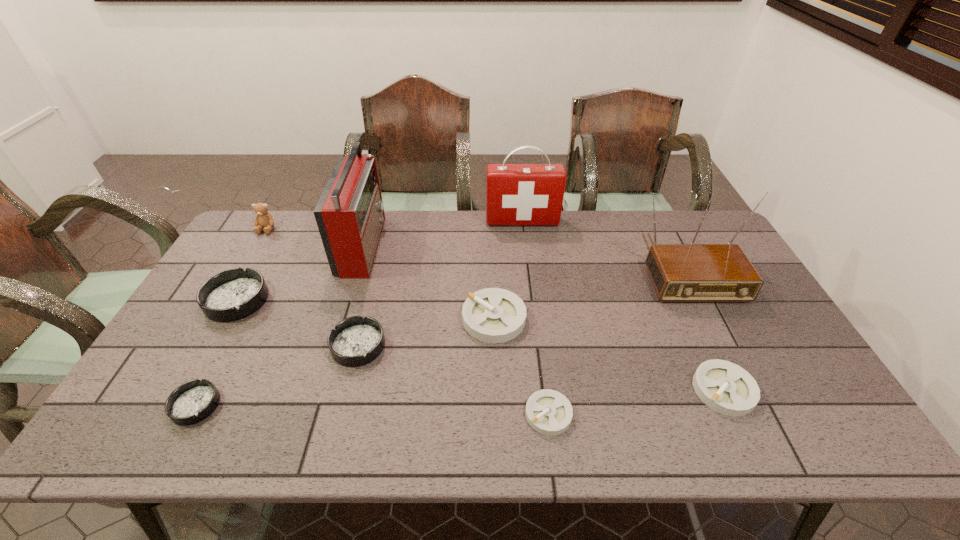
Where is `the left radio_receiver`? Image resolution: width=960 pixels, height=540 pixels. the left radio_receiver is located at coordinates (350, 216).

The height and width of the screenshot is (540, 960). In order to click on red first-aid kit in this screenshot , I will do 516,194.

Image resolution: width=960 pixels, height=540 pixels. Identify the location of the right radio_receiver. (692, 272).

The height and width of the screenshot is (540, 960). Find the location of `the seventh shortest object`. the seventh shortest object is located at coordinates (263, 219).

At what (x,y) coordinates should I click in order to perform the action: click on teddy bear. Please return your answer as a coordinate pair (x, y). This screenshot has height=540, width=960. Looking at the image, I should click on (263, 219).

Identify the location of the biggest dark ashtray. (233, 294).

At what (x,y) coordinates should I click in order to perform the action: click on the farthest gray ashtray. Please return your answer as a coordinate pair (x, y). Image resolution: width=960 pixels, height=540 pixels. Looking at the image, I should click on (493, 315).

The image size is (960, 540). Find the location of `the fourth ashtray from right to left`. the fourth ashtray from right to left is located at coordinates (356, 341).

Find the location of a particular element. The height and width of the screenshot is (540, 960). the rightmost dark ashtray is located at coordinates click(x=356, y=341).

Image resolution: width=960 pixels, height=540 pixels. I want to click on the rightmost ashtray, so click(725, 387).